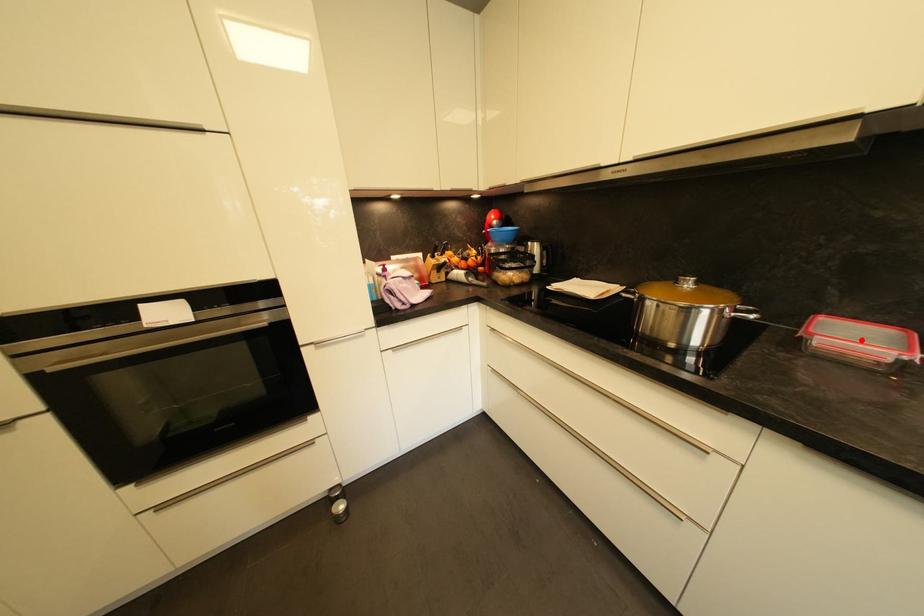
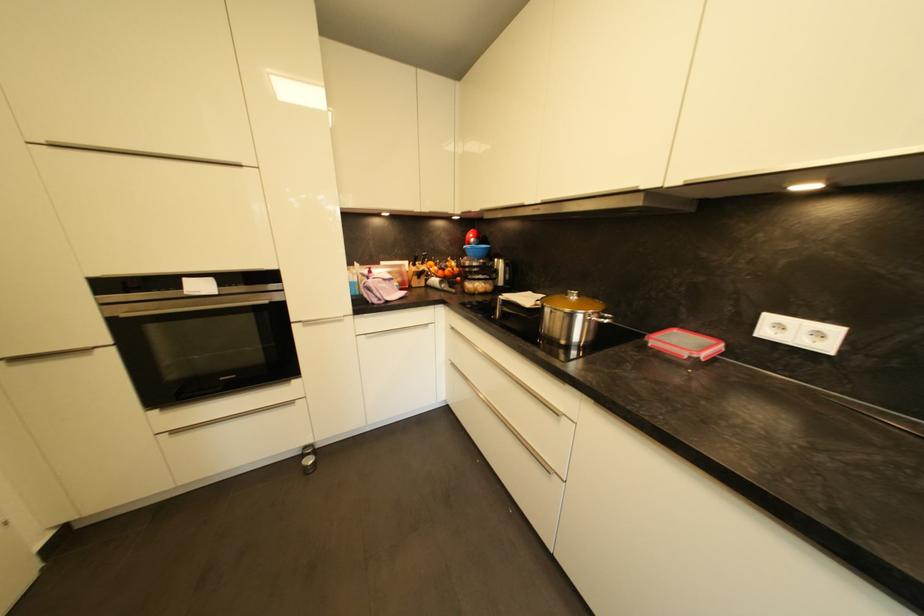
Where in the second image is the point corresponding to the highlighted location from the first image?

(686, 345)